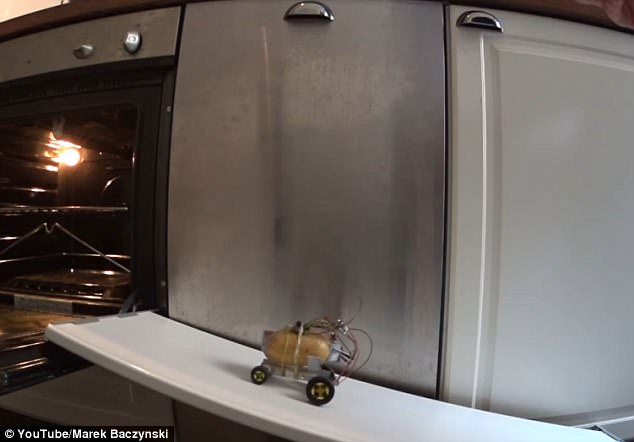
You are a GUI agent. You are given a task and a screenshot of the screen. Output one action in this format:
    pyautogui.click(x=<x>, y=<y>)
    Task: Click on the oven knob near the right edge
    The height and width of the screenshot is (442, 634).
    Given the screenshot: What is the action you would take?
    pyautogui.click(x=127, y=33)